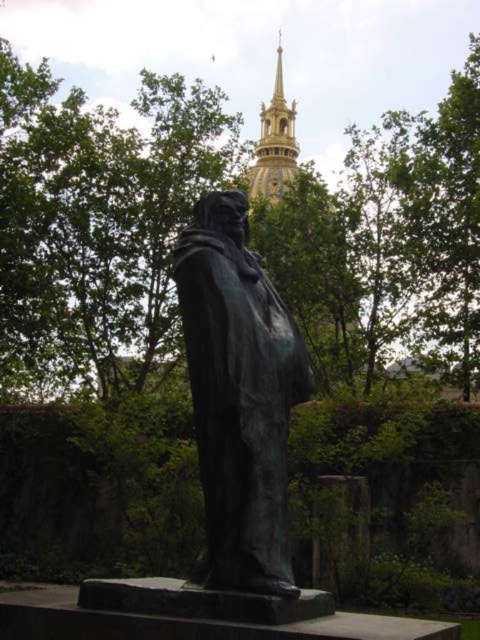
You are standing in front of the statue and want to take a photo that includes both the statue and the golden dome in the background. You notice two points marked on your camera screen at coordinates point (288, 362) and point (276, 74). Which point should you focus on to ensure both the statue and the dome are in focus?

You should focus on point (288, 362) because it is closer to the camera than point (276, 74), ensuring that both the nearby statue and the distant dome will be in focus when using the hyperfocal distance technique.

You are a visitor at the park and want to take a photo of the bronze statue at center and the gold textured spire at upper center. Which object should you focus on first if you want to include both in the same frame without moving your camera?

The bronze statue at center has a lesser height compared to the gold textured spire at upper center, so you should focus on the bronze statue at center first to ensure both are in the frame.

You are a tour guide explaining the landmarks in the park. You mention both the bronze statue at center and the gold textured spire at upper center. Which one is smaller in size?

The bronze statue at center is smaller in size compared to the gold textured spire at upper center.